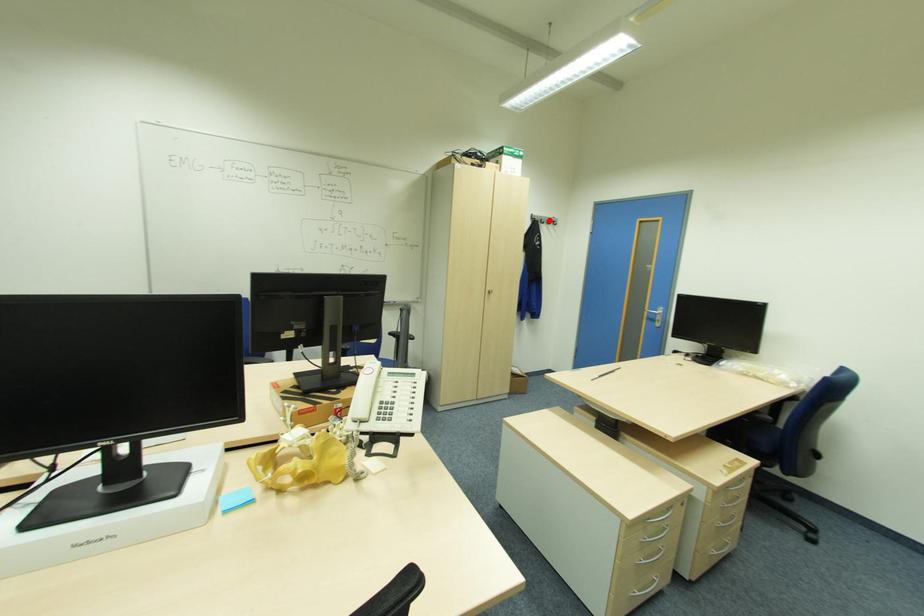
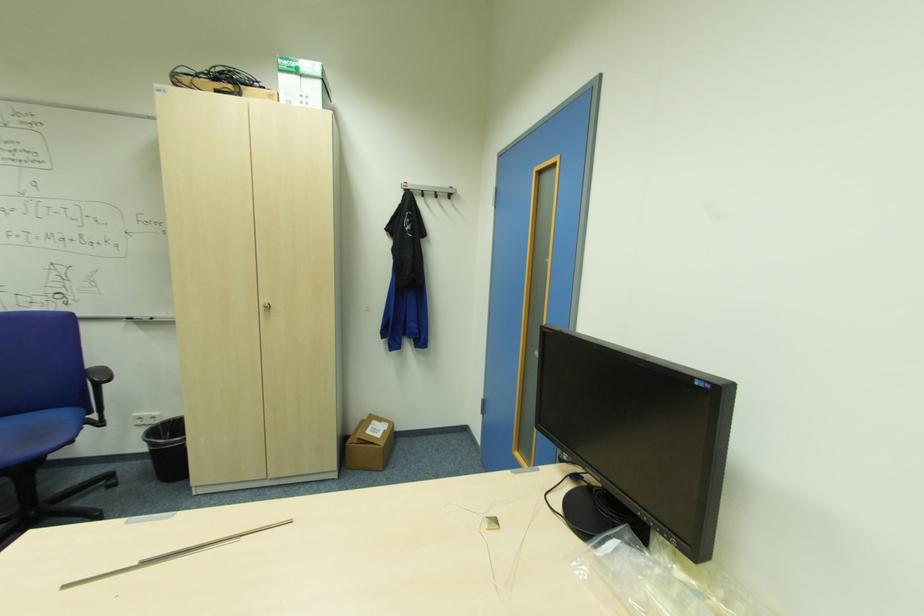
The point at the highlighted location is marked in the first image. Where is the corresponding point in the second image?

(439, 192)